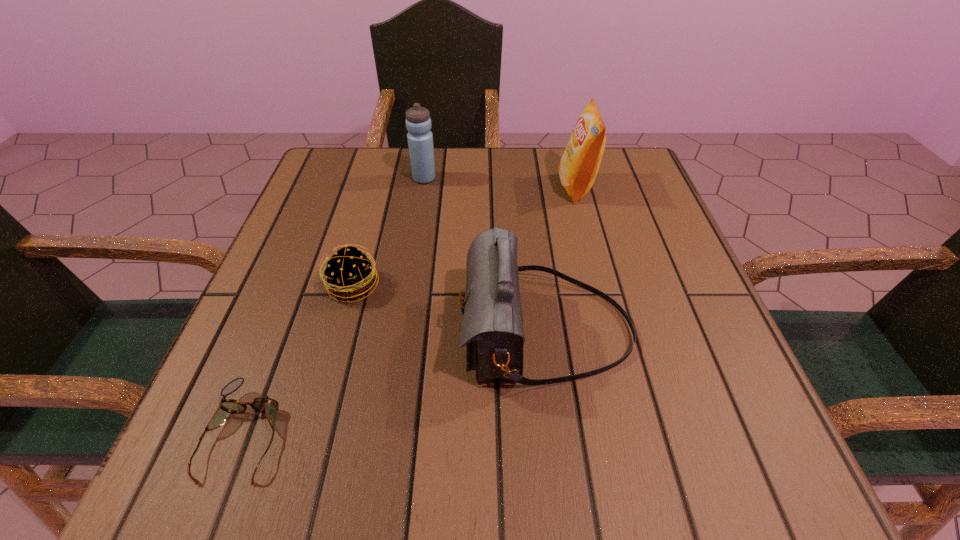
In the image, there is a desktop. What are the coordinates of `free space at the far edge` in the screenshot? It's located at (452, 166).

In the image, there is a desktop. Where is `blank space at the near edge`? blank space at the near edge is located at coordinates (512, 460).

Find the location of a particular element. vacant region at the left edge of the desktop is located at coordinates (300, 234).

In the image, there is a desktop. At what (x,y) coordinates should I click in order to perform the action: click on vacant region at the right edge. Please return your answer as a coordinate pair (x, y). Looking at the image, I should click on (662, 295).

In the image, there is a desktop. Identify the location of vacant space at the far left corner. Image resolution: width=960 pixels, height=540 pixels. (340, 160).

Locate an element on the screen. The width and height of the screenshot is (960, 540). blank space at the near left corner of the desktop is located at coordinates (277, 486).

You are a GUI agent. You are given a task and a screenshot of the screen. Output one action in this format:
    pyautogui.click(x=<x>, y=<y>)
    Task: Click on the vacant space at the near right corner of the desktop
    
    Given the screenshot: What is the action you would take?
    pyautogui.click(x=770, y=454)

Where is `unoccupied area between the third object from right to left and the patty`? The width and height of the screenshot is (960, 540). unoccupied area between the third object from right to left and the patty is located at coordinates (389, 232).

The width and height of the screenshot is (960, 540). Find the location of `vacant area that lies between the crisp (potato chip) and the fourth tallest object`. vacant area that lies between the crisp (potato chip) and the fourth tallest object is located at coordinates (465, 237).

Where is `empty space that is in between the shortest object and the crisp (potato chip)`? The width and height of the screenshot is (960, 540). empty space that is in between the shortest object and the crisp (potato chip) is located at coordinates (411, 310).